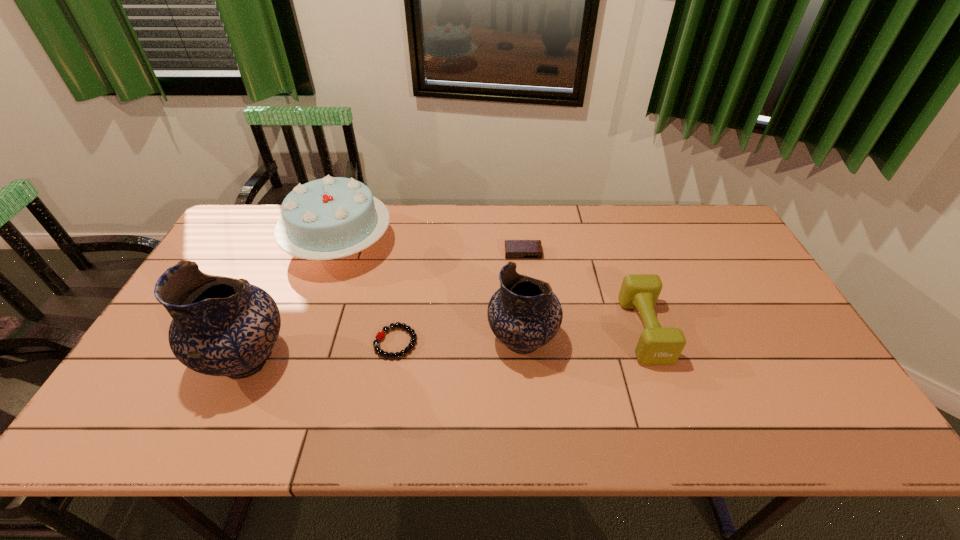
I want to click on vacant region at the near edge of the desktop, so click(x=297, y=383).

Identify the location of free space at the right edge of the desktop. (730, 281).

At what (x,y) coordinates should I click in order to perform the action: click on vacant region at the far left corner of the desktop. Please return your answer as a coordinate pair (x, y). Looking at the image, I should click on (229, 241).

Where is `vacant space in between the rightmost object and the second shortest object`? This screenshot has height=540, width=960. vacant space in between the rightmost object and the second shortest object is located at coordinates (584, 292).

This screenshot has height=540, width=960. I want to click on vacant area that lies between the shortest object and the tallest object, so click(322, 351).

Where is `vacant area between the birthday cake and the dumbbell`? The width and height of the screenshot is (960, 540). vacant area between the birthday cake and the dumbbell is located at coordinates (492, 287).

This screenshot has width=960, height=540. In order to click on free point between the alarm clock and the shortest object in this screenshot , I will do `click(459, 298)`.

Identify the location of free space between the fifth tallest object and the shortest object. The height and width of the screenshot is (540, 960). (459, 298).

Locate an element on the screen. free spot between the birthday cake and the left pottery is located at coordinates (293, 302).

The width and height of the screenshot is (960, 540). Identify the location of vacant point located between the right pottery and the left pottery. (384, 350).